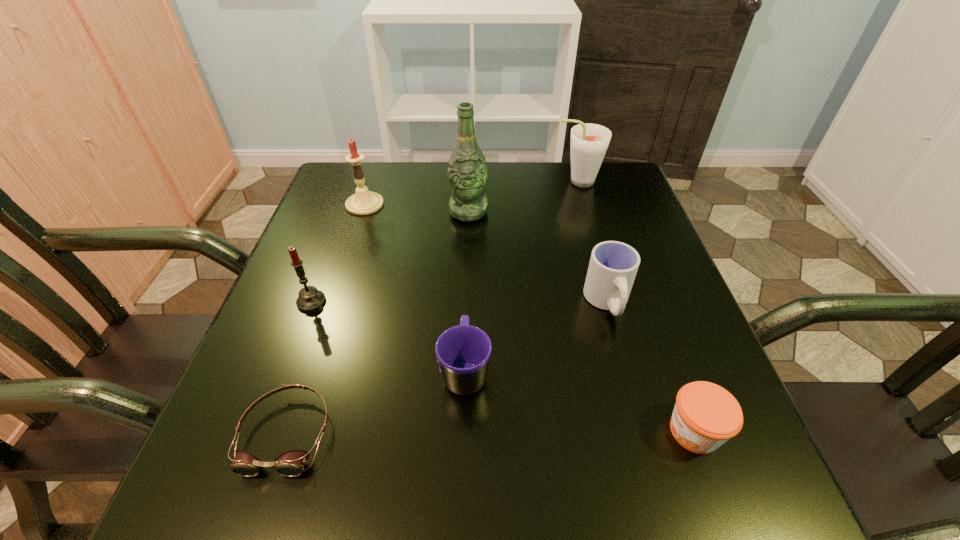
Where is `vacant space at the far left corner`? The height and width of the screenshot is (540, 960). vacant space at the far left corner is located at coordinates (326, 204).

The width and height of the screenshot is (960, 540). I want to click on vacant space at the near left corner of the desktop, so click(198, 506).

Find the location of a particular element. This screenshot has height=540, width=960. vacant region at the far right corner of the desktop is located at coordinates (574, 186).

Find the location of a particular element. unoccupied area between the tallest object and the root beer is located at coordinates (522, 197).

Image resolution: width=960 pixels, height=540 pixels. I want to click on free space between the third shortest object and the farther candle, so click(415, 287).

Locate an element on the screen. Image resolution: width=960 pixels, height=540 pixels. free space between the cup and the root beer is located at coordinates (592, 241).

At what (x,y) coordinates should I click in order to perform the action: click on free space that is in between the jam and the cup. Please return your answer as a coordinate pair (x, y). Looking at the image, I should click on (651, 367).

Locate an element on the screen. This screenshot has height=540, width=960. vacant space that's between the cup and the root beer is located at coordinates (592, 241).

Locate an element on the screen. free point between the cup and the farthest object is located at coordinates (592, 241).

I want to click on free spot between the seventh tallest object and the tallest object, so click(582, 322).